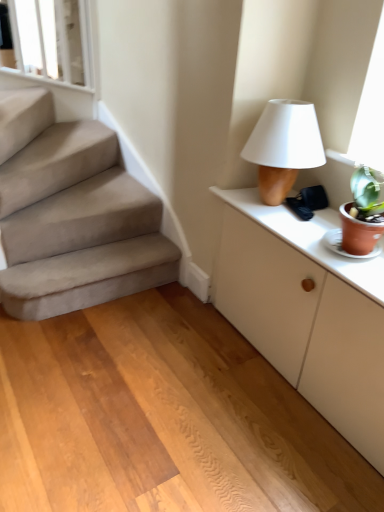
Question: From a real-world perspective, does wooden floor at center stand above matte brown table lamp at upper right?

Choices:
 (A) yes
 (B) no

Answer: (B)

Question: Does wooden floor at center appear on the right side of matte brown table lamp at upper right?

Choices:
 (A) yes
 (B) no

Answer: (B)

Question: Does wooden floor at center have a lesser height compared to matte brown table lamp at upper right?

Choices:
 (A) yes
 (B) no

Answer: (A)

Question: From the image's perspective, is wooden floor at center located beneath matte brown table lamp at upper right?

Choices:
 (A) yes
 (B) no

Answer: (A)

Question: From the image's perspective, is wooden floor at center on top of matte brown table lamp at upper right?

Choices:
 (A) yes
 (B) no

Answer: (B)

Question: Is wooden floor at center with matte brown table lamp at upper right?

Choices:
 (A) yes
 (B) no

Answer: (B)

Question: Does white glossy window frame at upper left have a larger size compared to wooden floor at center?

Choices:
 (A) no
 (B) yes

Answer: (A)

Question: Is white glossy window frame at upper left wider than wooden floor at center?

Choices:
 (A) no
 (B) yes

Answer: (A)

Question: Is the surface of white glossy window frame at upper left in direct contact with wooden floor at center?

Choices:
 (A) yes
 (B) no

Answer: (B)

Question: Is the depth of white glossy window frame at upper left greater than that of wooden floor at center?

Choices:
 (A) no
 (B) yes

Answer: (B)

Question: Considering the relative sizes of white glossy window frame at upper left and wooden floor at center in the image provided, is white glossy window frame at upper left thinner than wooden floor at center?

Choices:
 (A) no
 (B) yes

Answer: (B)

Question: From a real-world perspective, is white glossy window frame at upper left physically above wooden floor at center?

Choices:
 (A) yes
 (B) no

Answer: (A)

Question: Is white glossy window frame at upper left facing away from matte brown table lamp at upper right?

Choices:
 (A) no
 (B) yes

Answer: (A)